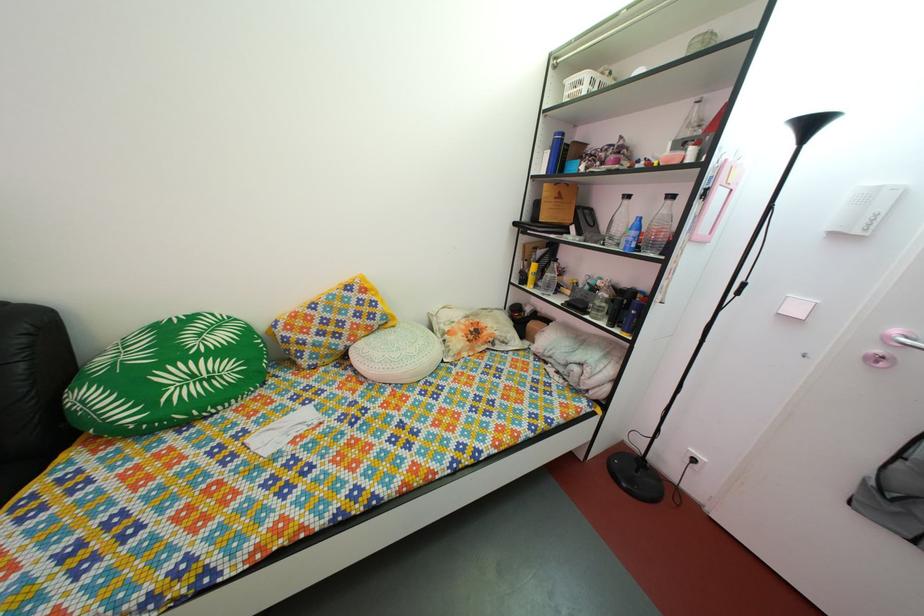
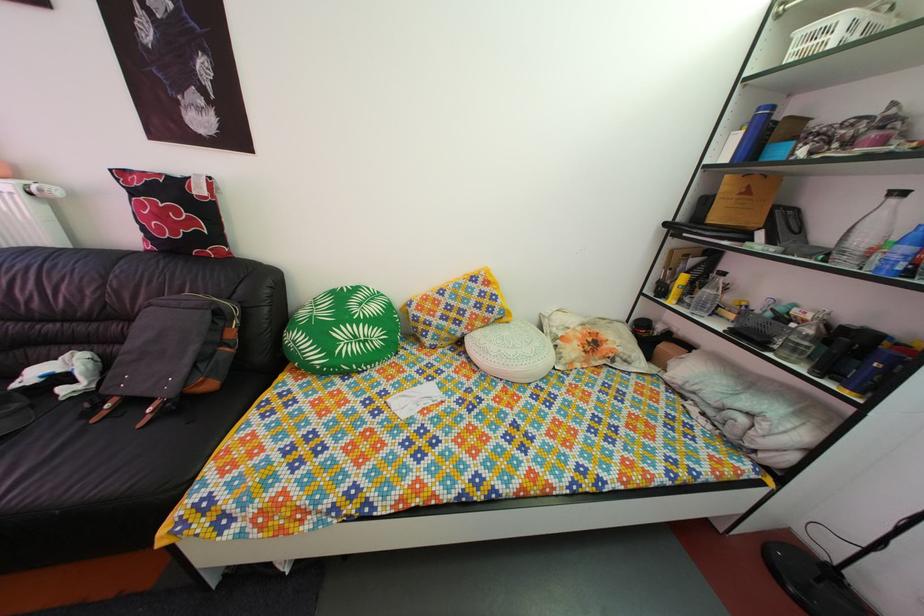
Question: The images are taken continuously from a first-person perspective. In which direction are you moving?

Choices:
 (A) Left
 (B) Right
 (C) Forward
 (D) Backward

Answer: (A)